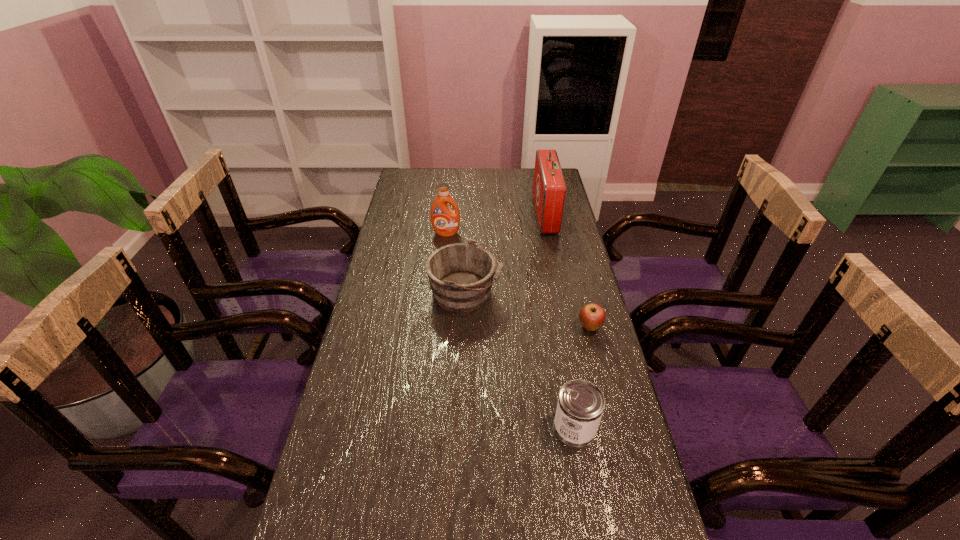
What are the coordinates of `vacant space situated on the back of the nearest object` in the screenshot? It's located at (556, 318).

The image size is (960, 540). I want to click on vacant space located 0.380m on the back of the shortest object, so click(x=568, y=244).

Locate an element on the screen. This screenshot has height=540, width=960. object located in the far edge section of the desktop is located at coordinates (549, 187).

Locate an element on the screen. Image resolution: width=960 pixels, height=540 pixels. the first-aid kit located in the right edge section of the desktop is located at coordinates (549, 187).

This screenshot has height=540, width=960. I want to click on can present at the right edge, so click(580, 406).

The image size is (960, 540). I want to click on apple positioned at the right edge, so click(592, 316).

I want to click on object at the far right corner, so click(x=549, y=187).

Identify the location of free space at the far edge. (480, 186).

This screenshot has height=540, width=960. In order to click on free space at the left edge in this screenshot , I will do `click(384, 278)`.

Locate an element on the screen. The width and height of the screenshot is (960, 540). free spot at the right edge of the desktop is located at coordinates (537, 228).